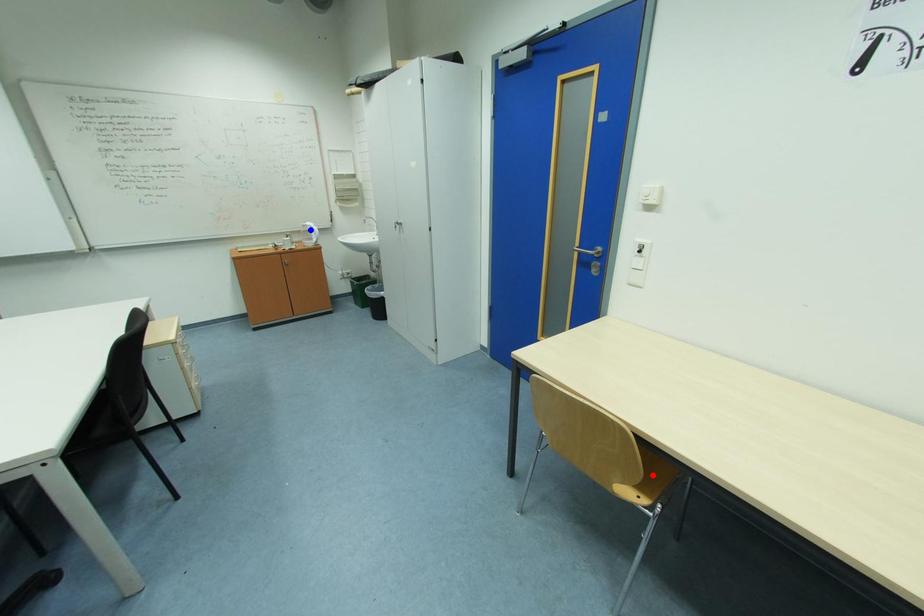
Question: Two points are marked on the image. Which point is closer to the camera?

Choices:
 (A) Blue point is closer.
 (B) Red point is closer.

Answer: (B)